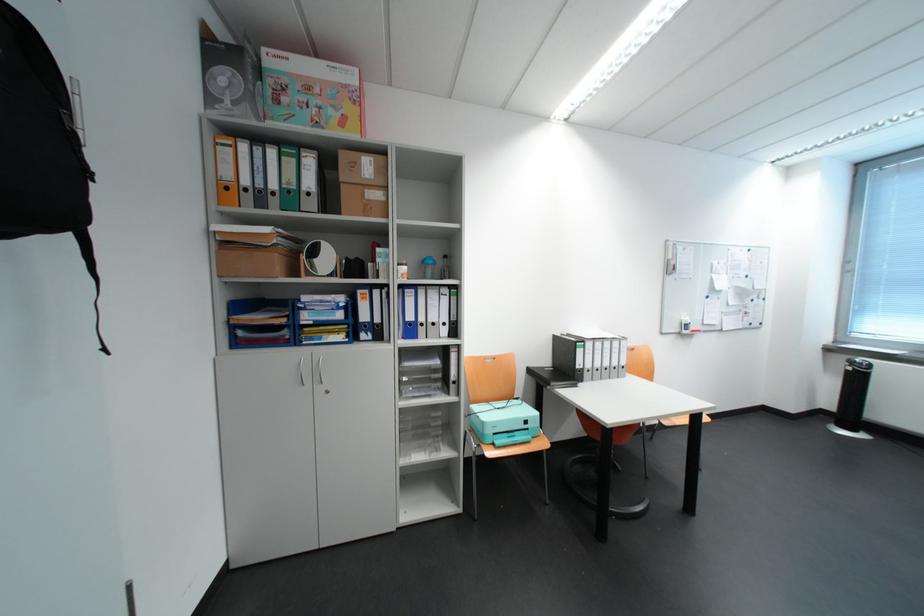
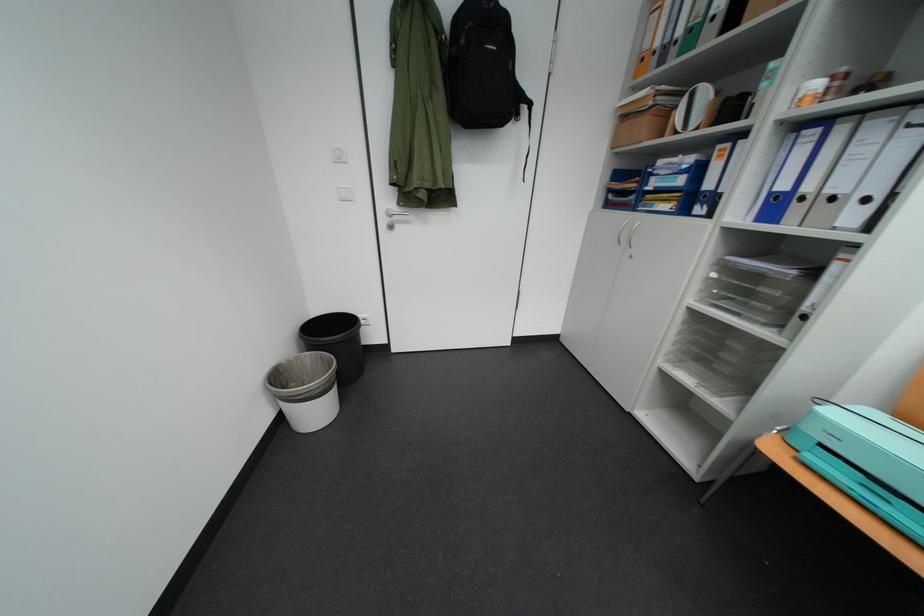
Where in the second image is the point corresponding to point 417,379 from the first image?

(724, 277)